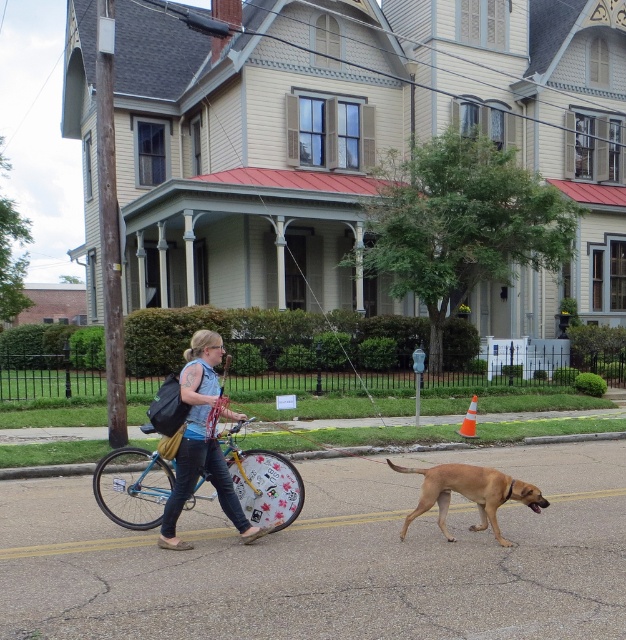
Is blue metallic bicycle at center wider than denim jacket at center?

Yes, blue metallic bicycle at center is wider than denim jacket at center.

Is blue metallic bicycle at center in front of denim jacket at center?

No, blue metallic bicycle at center is behind denim jacket at center.

Where is `blue metallic bicycle at center`? blue metallic bicycle at center is located at coordinates [x=131, y=486].

Which is above, blue metallic bicycle at center or golden brown fur at center?

blue metallic bicycle at center

Does blue metallic bicycle at center appear under golden brown fur at center?

Incorrect, blue metallic bicycle at center is not positioned below golden brown fur at center.

Where is `blue metallic bicycle at center`? blue metallic bicycle at center is located at coordinates (131, 486).

Locate an element on the screen. This screenshot has width=626, height=640. blue metallic bicycle at center is located at coordinates (131, 486).

From the picture: Does denim jacket at center appear on the left side of golden brown fur at center?

Yes, denim jacket at center is to the left of golden brown fur at center.

Is point (198, 376) more distant than point (408, 518)?

No, it is not.

The width and height of the screenshot is (626, 640). In order to click on denim jacket at center in this screenshot , I will do `click(202, 444)`.